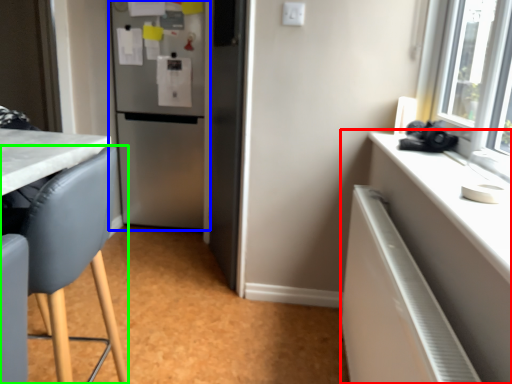
Question: Which object is positioned closest to cabinetry (highlighted by a red box)? Select from refrigerator (highlighted by a blue box) and chair (highlighted by a green box).

Choices:
 (A) refrigerator
 (B) chair

Answer: (B)